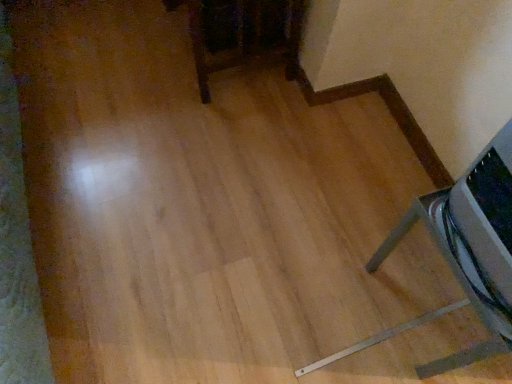
Question: From the image's perspective, is metallic silver speaker at lower right, placed as the second furniture when sorted from left to right, over dark wood table at upper center, arranged as the second furniture when viewed from the right?

Choices:
 (A) no
 (B) yes

Answer: (A)

Question: Can you confirm if metallic silver speaker at lower right, positioned as the 2th furniture in top-to-bottom order, is smaller than dark wood table at upper center, which is the second furniture in bottom-to-top order?

Choices:
 (A) yes
 (B) no

Answer: (A)

Question: Are metallic silver speaker at lower right, the 1th furniture positioned from the bottom, and dark wood table at upper center, which is the second furniture in bottom-to-top order, located far from each other?

Choices:
 (A) no
 (B) yes

Answer: (A)

Question: From a real-world perspective, is metallic silver speaker at lower right, arranged as the first furniture when viewed from the right, below dark wood table at upper center, marked as the first furniture in a left-to-right arrangement?

Choices:
 (A) yes
 (B) no

Answer: (B)

Question: Is metallic silver speaker at lower right, placed as the second furniture when sorted from left to right, facing towards dark wood table at upper center, which is the second furniture in bottom-to-top order?

Choices:
 (A) yes
 (B) no

Answer: (B)

Question: Is metallic silver speaker at lower right, placed as the second furniture when sorted from left to right, next to dark wood table at upper center, arranged as the second furniture when viewed from the right?

Choices:
 (A) yes
 (B) no

Answer: (B)

Question: Does dark wood table at upper center, arranged as the second furniture when viewed from the right, have a smaller size compared to metallic silver speaker at lower right, arranged as the first furniture when viewed from the right?

Choices:
 (A) no
 (B) yes

Answer: (A)

Question: From the image's perspective, does dark wood table at upper center, marked as the first furniture in a left-to-right arrangement, appear lower than metallic silver speaker at lower right, arranged as the first furniture when viewed from the right?

Choices:
 (A) yes
 (B) no

Answer: (B)

Question: Are dark wood table at upper center, marked as the first furniture in a left-to-right arrangement, and metallic silver speaker at lower right, positioned as the 2th furniture in top-to-bottom order, far apart?

Choices:
 (A) no
 (B) yes

Answer: (A)

Question: Does dark wood table at upper center, which is counted as the first furniture, starting from the top, have a lesser height compared to metallic silver speaker at lower right, positioned as the 2th furniture in top-to-bottom order?

Choices:
 (A) yes
 (B) no

Answer: (B)

Question: Is dark wood table at upper center, which is the second furniture in bottom-to-top order, placed right next to metallic silver speaker at lower right, positioned as the 2th furniture in top-to-bottom order?

Choices:
 (A) no
 (B) yes

Answer: (A)

Question: Can you confirm if dark wood table at upper center, arranged as the second furniture when viewed from the right, is positioned to the left of metallic silver speaker at lower right, arranged as the first furniture when viewed from the right?

Choices:
 (A) yes
 (B) no

Answer: (A)

Question: Is dark wood table at upper center, arranged as the second furniture when viewed from the right, bigger or smaller than metallic silver speaker at lower right, placed as the second furniture when sorted from left to right?

Choices:
 (A) small
 (B) big

Answer: (B)